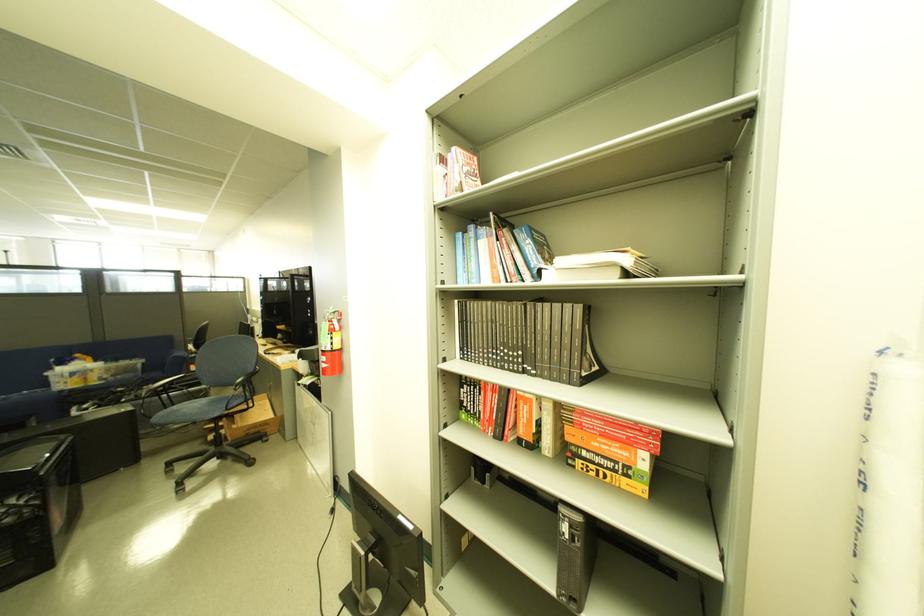
Describe the element at coordinates (172, 386) in the screenshot. I see `the chair armrest` at that location.